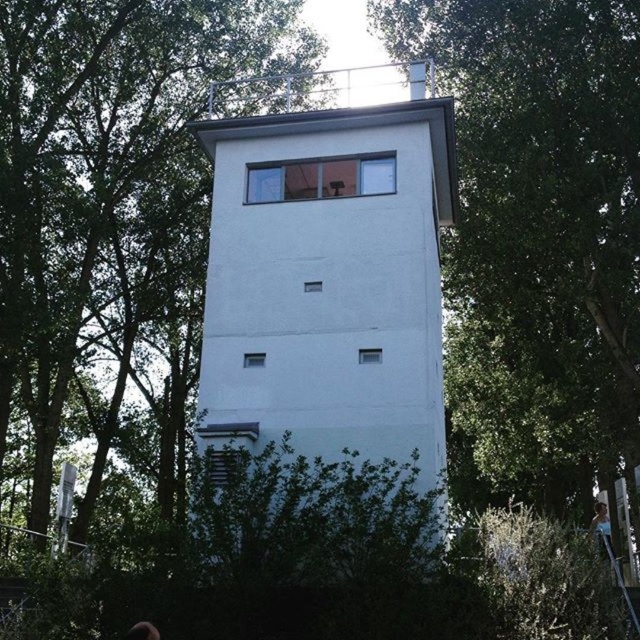
You are standing at the base of the watchtower and looking up at its facade. There are two points marked on the tower. One is at coordinates point (186, 202) and the other at point (156, 634). Which point is closer to you?

Point (186, 202) is further to the viewer than point (156, 634), so the point closer to you is point (156, 634).

You are standing in front of the tall rectangular building and notice the green leafy tree at right and the light blue shirt at center. Which object is wider?

The green leafy tree at right is wider than the light blue shirt at center.

You are a maintenance worker needing to climb the metallic silver ladder at lower right to reach the top of the tower. However, there is a green leafy tree at center nearby. Could the tree potentially block your path while climbing the ladder?

The green leafy tree at center might be wider than the metallic silver ladder at lower right, so there is a possibility that the tree could block your path while climbing the ladder.